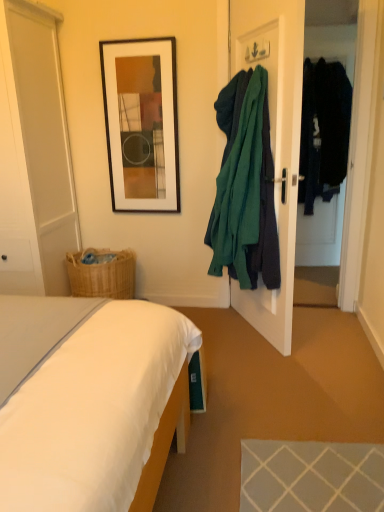
Question: Is teal fabric coat at right, the 2th clothing when ordered from right to left, behind transparent glass door at right, positioned as the 2th glass door in left-to-right order?

Choices:
 (A) yes
 (B) no

Answer: (B)

Question: Can you confirm if teal fabric coat at right, the 2th clothing when ordered from right to left, is smaller than transparent glass door at right, marked as the 1th glass door in a right-to-left arrangement?

Choices:
 (A) no
 (B) yes

Answer: (A)

Question: Is the surface of teal fabric coat at right, acting as the 2th clothing starting from the back, in direct contact with transparent glass door at right, marked as the 1th glass door in a right-to-left arrangement?

Choices:
 (A) no
 (B) yes

Answer: (A)

Question: Is teal fabric coat at right, the 2th clothing when ordered from right to left, far from transparent glass door at right, positioned as the 2th glass door in left-to-right order?

Choices:
 (A) yes
 (B) no

Answer: (A)

Question: Considering the relative sizes of teal fabric coat at right, the first clothing positioned from the left, and transparent glass door at right, positioned as the 2th glass door in left-to-right order, in the image provided, is teal fabric coat at right, the first clothing positioned from the left, shorter than transparent glass door at right, positioned as the 2th glass door in left-to-right order,?

Choices:
 (A) yes
 (B) no

Answer: (A)

Question: Can you confirm if teal fabric coat at right, positioned as the first clothing in front-to-back order, is thinner than transparent glass door at right, positioned as the 2th glass door in left-to-right order?

Choices:
 (A) yes
 (B) no

Answer: (B)

Question: Is dark blue fabric coat at right, which ranks as the 2th clothing in left-to-right order, not close to white fabric bed at lower left?

Choices:
 (A) no
 (B) yes

Answer: (B)

Question: From a real-world perspective, is dark blue fabric coat at right, arranged as the 2th clothing when viewed from the front, over white fabric bed at lower left?

Choices:
 (A) yes
 (B) no

Answer: (A)

Question: Is dark blue fabric coat at right, which ranks as the 2th clothing in left-to-right order, outside white fabric bed at lower left?

Choices:
 (A) no
 (B) yes

Answer: (B)

Question: From the image's perspective, is dark blue fabric coat at right, marked as the 1th clothing in a right-to-left arrangement, located above white fabric bed at lower left?

Choices:
 (A) no
 (B) yes

Answer: (B)

Question: Is dark blue fabric coat at right, marked as the first clothing in a back-to-front arrangement, smaller than white fabric bed at lower left?

Choices:
 (A) yes
 (B) no

Answer: (A)

Question: Does dark blue fabric coat at right, which ranks as the 2th clothing in left-to-right order, have a lesser height compared to white fabric bed at lower left?

Choices:
 (A) no
 (B) yes

Answer: (A)

Question: Is white glossy door at left, placed as the first glass door when sorted from left to right, to the right of teal fabric coat at right, the first clothing positioned from the left, from the viewer's perspective?

Choices:
 (A) no
 (B) yes

Answer: (A)